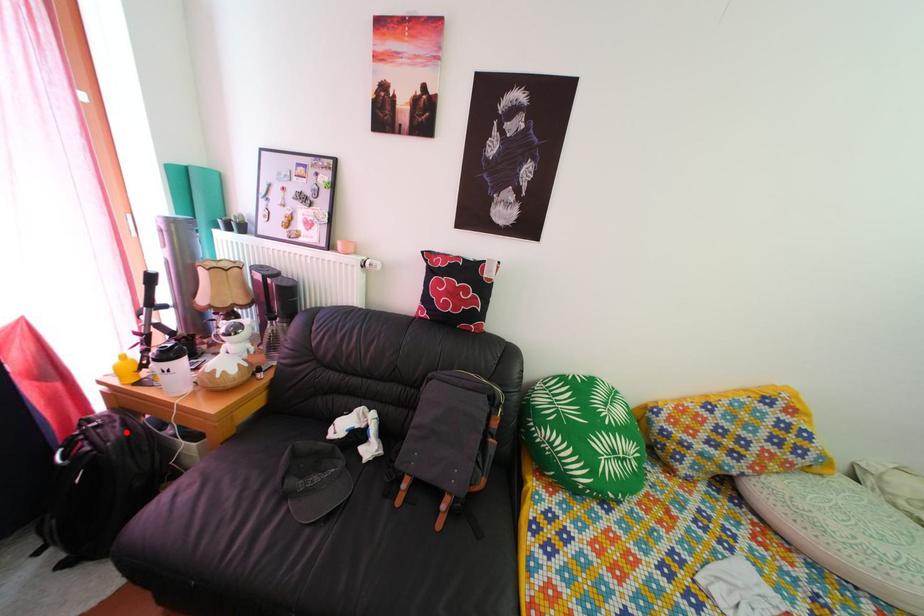
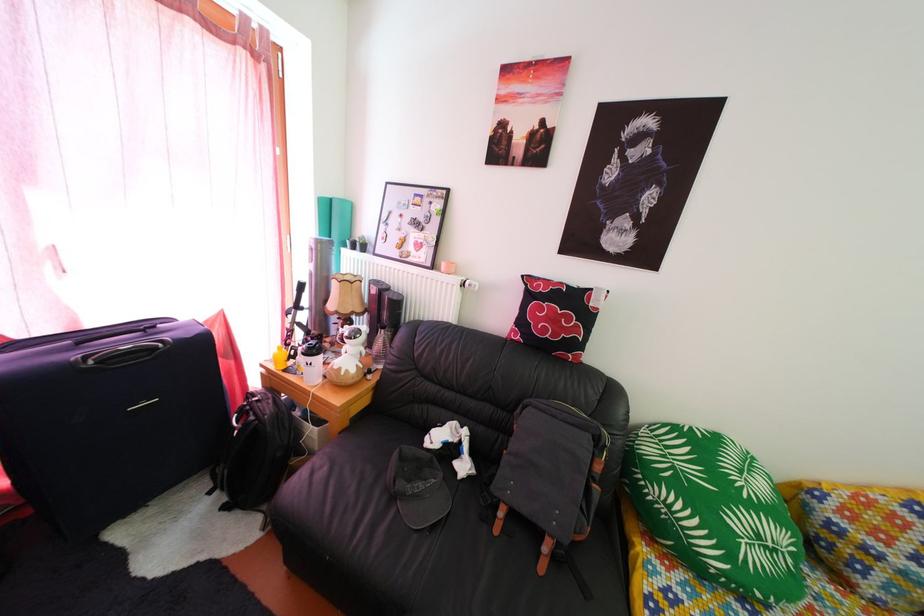
Where in the second image is the point corresponding to the highlighted location from the first image?

(280, 410)